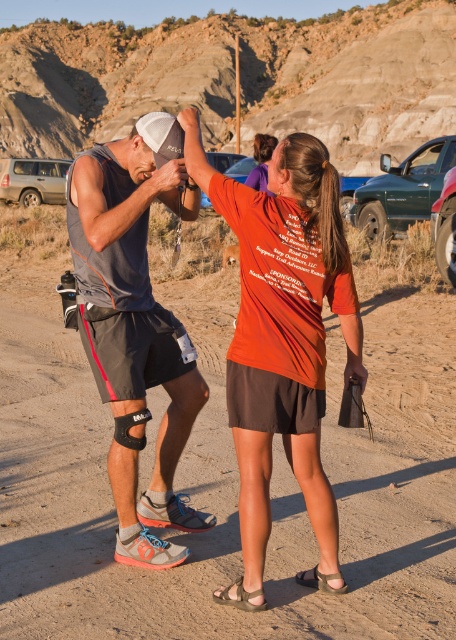
You are driving a car and see the silver metallic suv at upper left and the metallic silver car at center. Which one is blocking your view of the road ahead?

The silver metallic suv at upper left is blocking your view of the road ahead because it is positioned over the metallic silver car at center.

You are a photographer trying to capture a photo of the orange cotton shirt at center and the metallic silver car at center. Based on their positions, which object should you focus on first if you want to include both in the frame without moving your camera?

The orange cotton shirt at center is to the right of the metallic silver car at center, so you should focus on the metallic silver car at center first as it is closer to the left side of the frame, allowing both objects to be included without moving the camera.